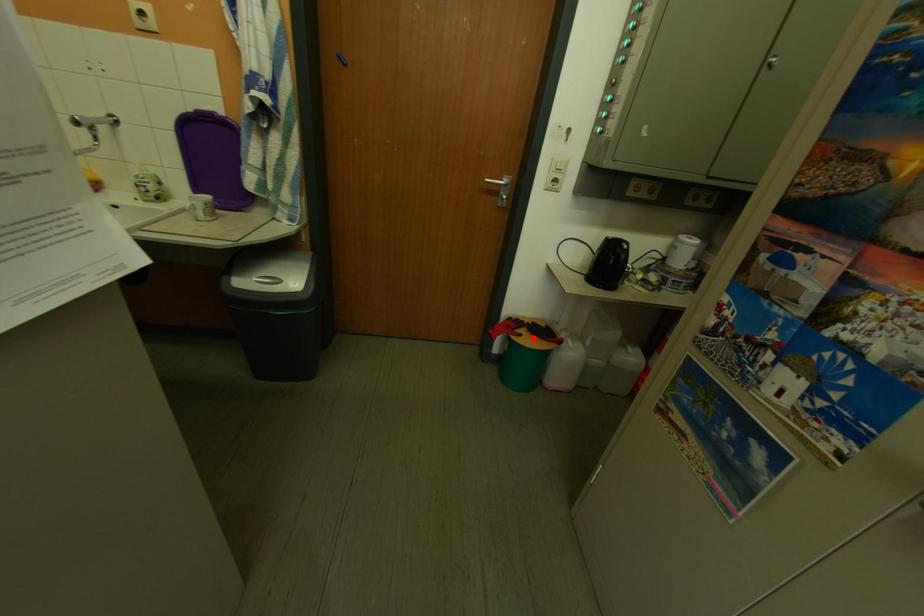
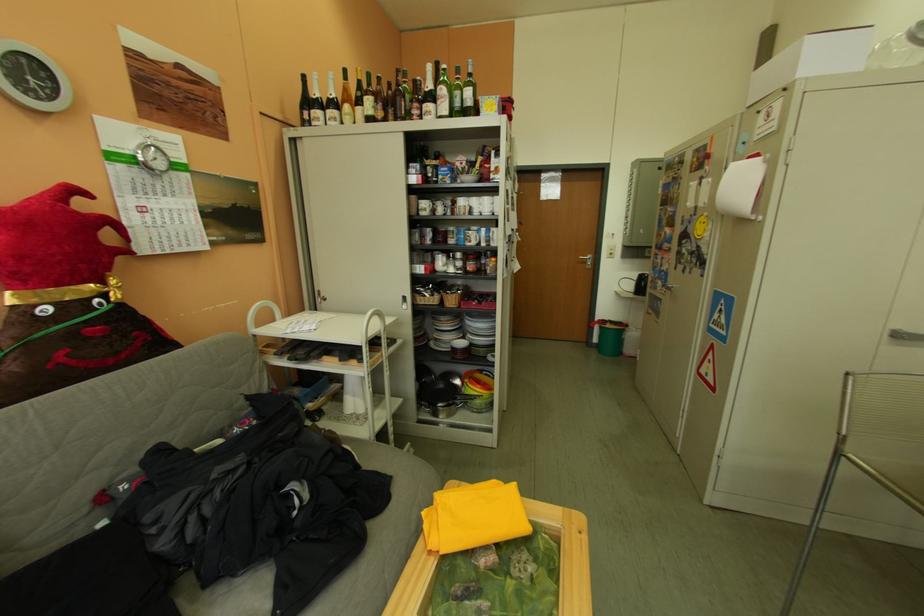
Question: I am providing you with two images of the same scene from different viewpoints. In image1, a red point is highlighted. Considering the same 3D point in image2, which of the following is correct?

Choices:
 (A) It is closer
 (B) It is farther

Answer: (A)